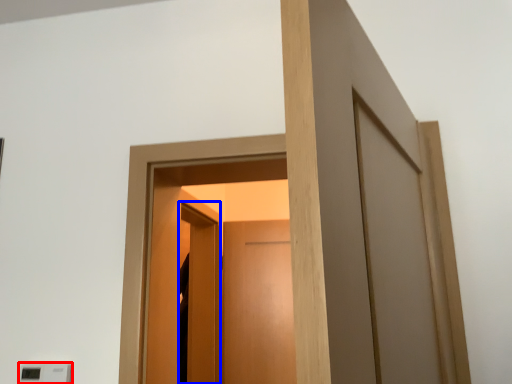
Question: Which object is further to the camera taking this photo, light switch (highlighted by a red box) or screen door (highlighted by a blue box)?

Choices:
 (A) light switch
 (B) screen door

Answer: (B)